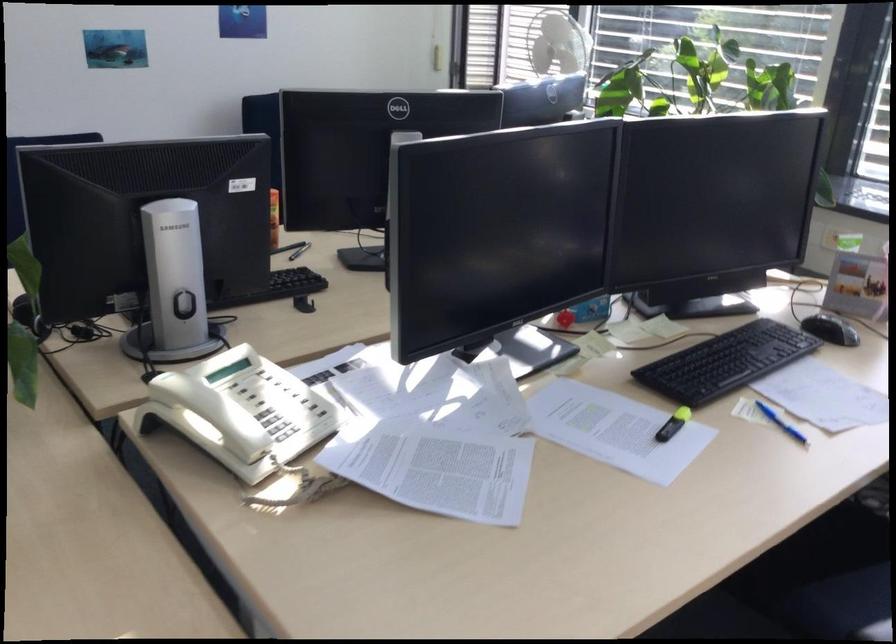
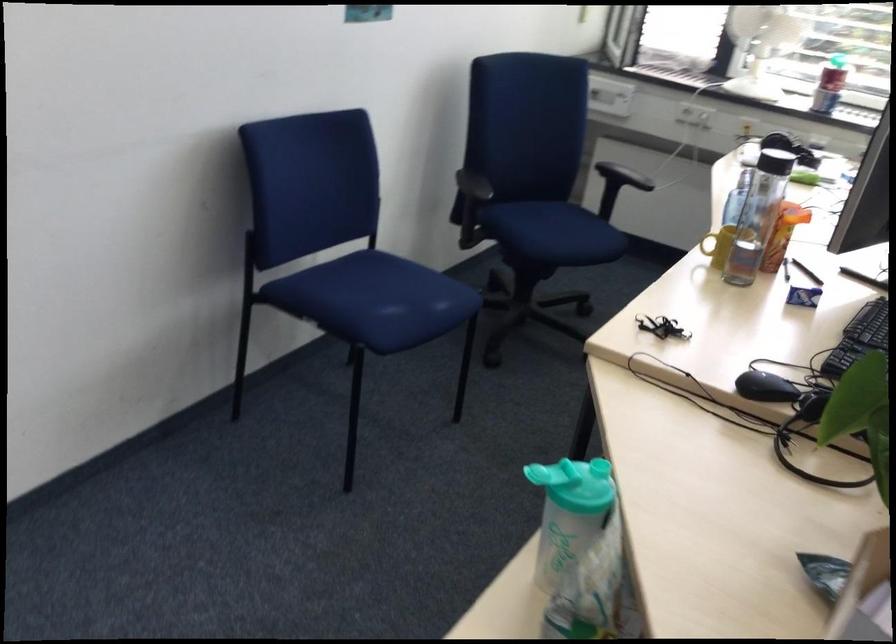
The images are taken continuously from a first-person perspective. In which direction are you moving?

The cameraman moved toward left, forward.